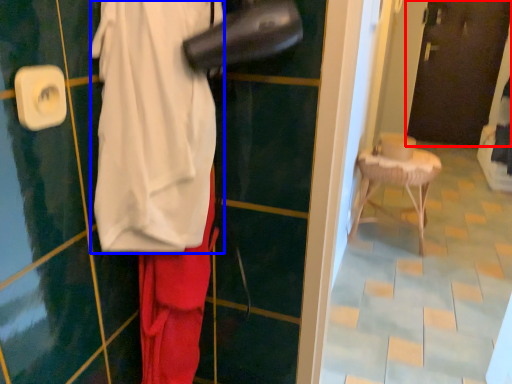
Question: Among these objects, which one is farthest to the camera, door (highlighted by a red box) or wide (highlighted by a blue box)?

Choices:
 (A) door
 (B) wide

Answer: (A)